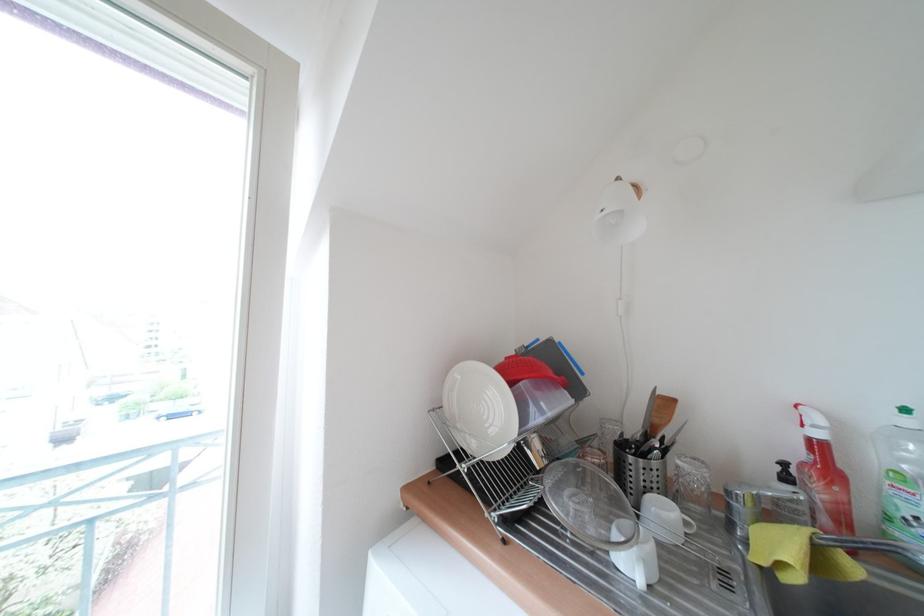
The width and height of the screenshot is (924, 616). What do you see at coordinates (876, 548) in the screenshot?
I see `the faucet handle` at bounding box center [876, 548].